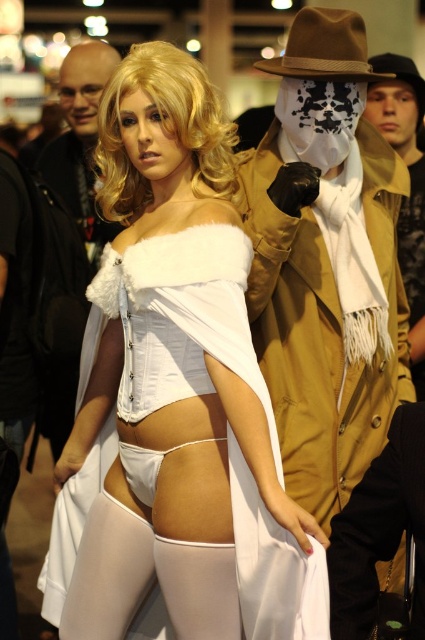
Who is positioned more to the right, tan leather trench coat at center or brown straw cowboy hat at upper center?

tan leather trench coat at center

Where is `tan leather trench coat at center`? The image size is (425, 640). tan leather trench coat at center is located at coordinates (325, 262).

Where is `tan leather trench coat at center`? tan leather trench coat at center is located at coordinates (325, 262).

Can you confirm if white satin dress at center is thinner than tan leather jacket at upper right?

In fact, white satin dress at center might be wider than tan leather jacket at upper right.

Does white satin dress at center appear over tan leather jacket at upper right?

Actually, white satin dress at center is below tan leather jacket at upper right.

Identify the location of white satin dress at center. This screenshot has height=640, width=425. (181, 388).

Where is `white satin dress at center`? The image size is (425, 640). white satin dress at center is located at coordinates (181, 388).

Describe the element at coordinates (325, 262) in the screenshot. I see `tan leather trench coat at center` at that location.

Between point (328, 429) and point (382, 83), which one is positioned in front?

Point (328, 429) is in front.

Locate an element on the screen. The height and width of the screenshot is (640, 425). tan leather trench coat at center is located at coordinates (325, 262).